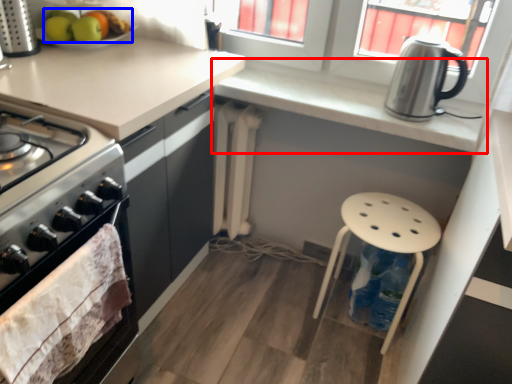
Question: Among these objects, which one is farthest to the camera, countertop (highlighted by a red box) or fruit (highlighted by a blue box)?

Choices:
 (A) countertop
 (B) fruit

Answer: (B)